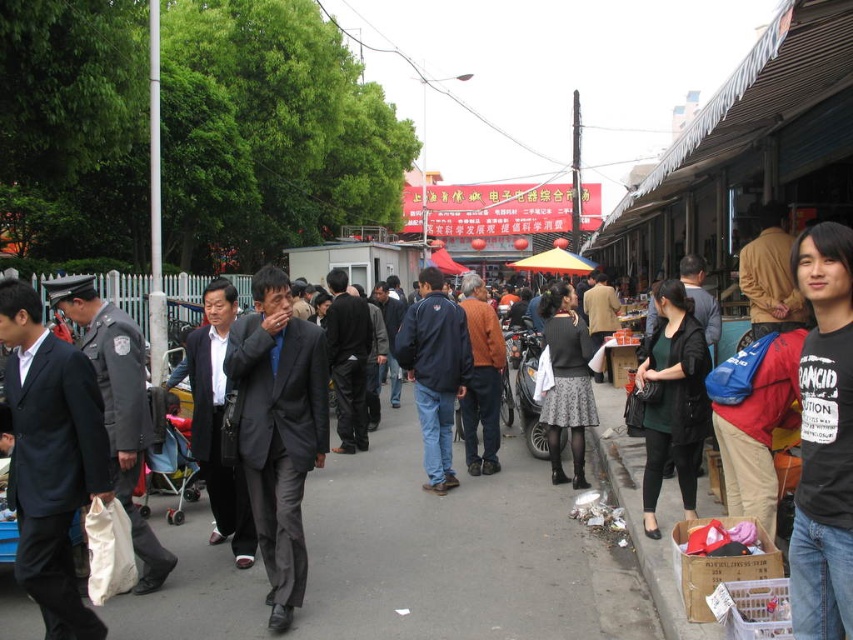
Who is more distant from viewer, (22, 422) or (482, 445)?

The point (482, 445) is behind.

Is dark blue suit at left above orange knit sweater at center?

Incorrect, dark blue suit at left is not positioned above orange knit sweater at center.

Between point (54, 340) and point (471, 326), which one is positioned behind?

The point (471, 326) is behind.

What are the coordinates of `dark blue suit at left` in the screenshot? It's located at (51, 458).

Does dark green jersey at center come behind dark gray textured skirt at center?

No, dark green jersey at center is in front of dark gray textured skirt at center.

Is dark green jersey at center positioned before dark gray textured skirt at center?

Yes, dark green jersey at center is closer to the viewer.

Between point (698, 444) and point (561, 412), which one is positioned in front?

Point (698, 444) is more forward.

You are a GUI agent. You are given a task and a screenshot of the screen. Output one action in this format:
    pyautogui.click(x=<x>, y=<y>)
    Task: Click on the dark green jersey at center
    The height and width of the screenshot is (640, 853).
    Given the screenshot: What is the action you would take?
    pyautogui.click(x=672, y=400)

Is the position of black fabric pavement at center more distant than that of orange knit sweater at center?

That is False.

Based on the photo, does black fabric pavement at center appear over orange knit sweater at center?

Actually, black fabric pavement at center is below orange knit sweater at center.

Locate an element on the screen. black fabric pavement at center is located at coordinates (457, 554).